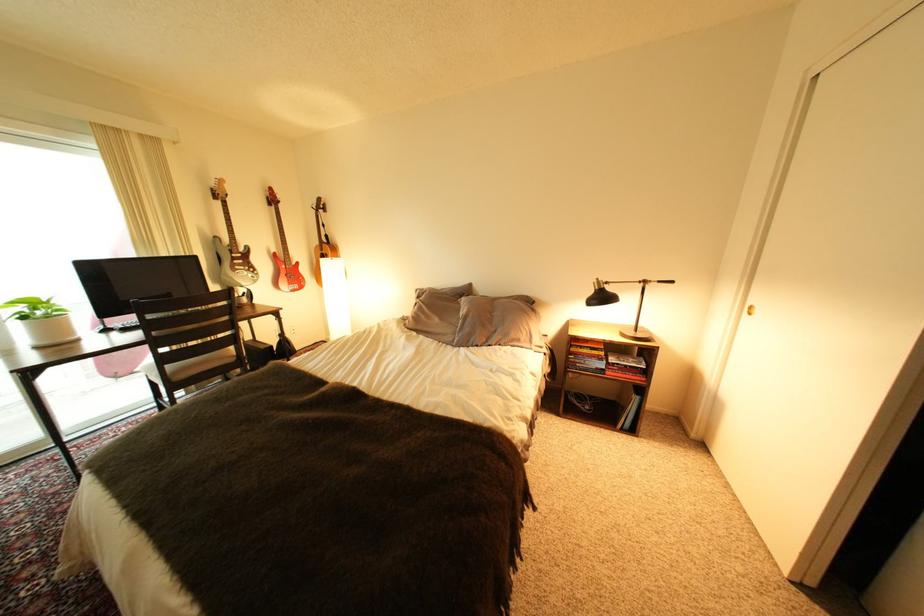
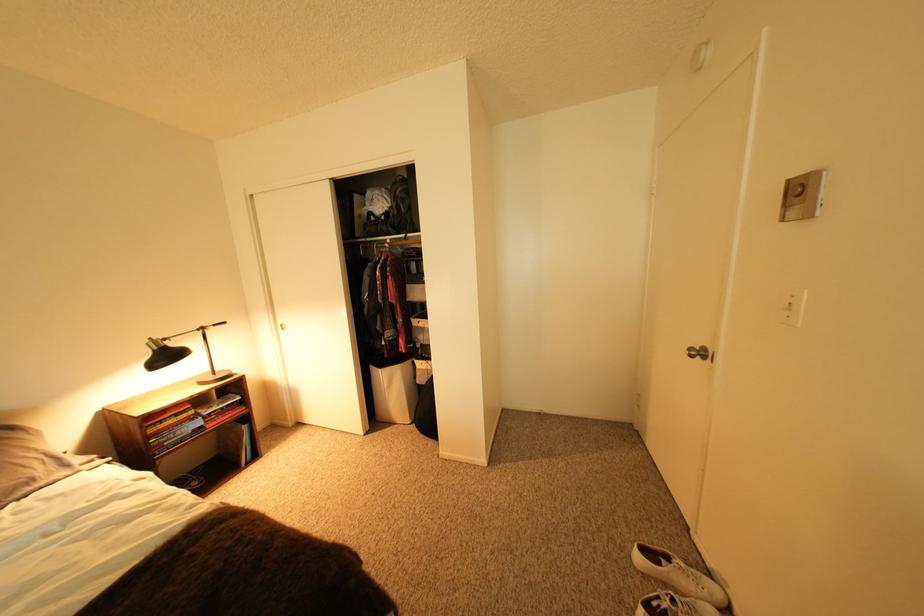
In the second image, find the point that corresponds to point (598, 363) in the first image.

(188, 435)